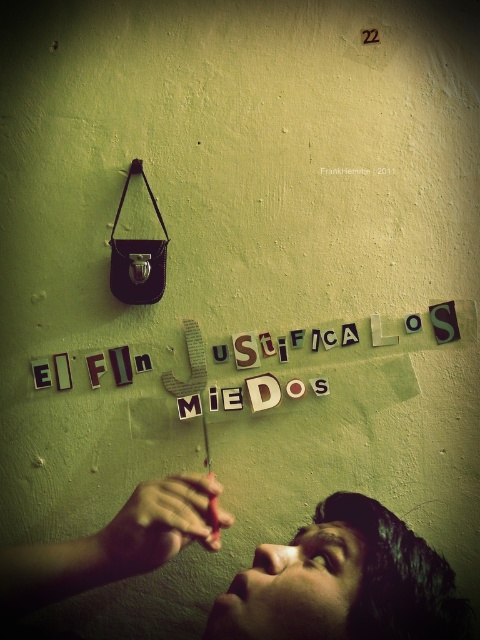
Can you confirm if smooth skin face at lower center is positioned above smooth skin hand at lower center?

No, smooth skin face at lower center is not above smooth skin hand at lower center.

Based on the photo, how far apart are smooth skin face at lower center and smooth skin hand at lower center?

smooth skin face at lower center is 3.68 inches away from smooth skin hand at lower center.

Is point (342, 588) more distant than point (180, 486)?

No.

You are a GUI agent. You are given a task and a screenshot of the screen. Output one action in this format:
    pyautogui.click(x=<x>, y=<y>)
    Task: Click on the smooth skin face at lower center
    
    Given the screenshot: What is the action you would take?
    pyautogui.click(x=344, y=582)

Which is more to the left, wooden letters at center or smooth skin hand at lower center?

smooth skin hand at lower center

Is wooden letters at center above smooth skin hand at lower center?

Correct, wooden letters at center is located above smooth skin hand at lower center.

Is point (346, 333) farther from camera compared to point (187, 484)?

Yes.

This screenshot has width=480, height=640. In order to click on wooden letters at center in this screenshot , I will do `click(190, 364)`.

Is point (407, 573) farther from viewer compared to point (396, 339)?

No, (407, 573) is closer to viewer.

Can you confirm if smooth skin face at lower center is positioned above wooden letters at center?

Incorrect, smooth skin face at lower center is not positioned above wooden letters at center.

You are a GUI agent. You are given a task and a screenshot of the screen. Output one action in this format:
    pyautogui.click(x=<x>, y=<y>)
    Task: Click on the smooth skin face at lower center
    The height and width of the screenshot is (640, 480).
    Given the screenshot: What is the action you would take?
    pyautogui.click(x=344, y=582)